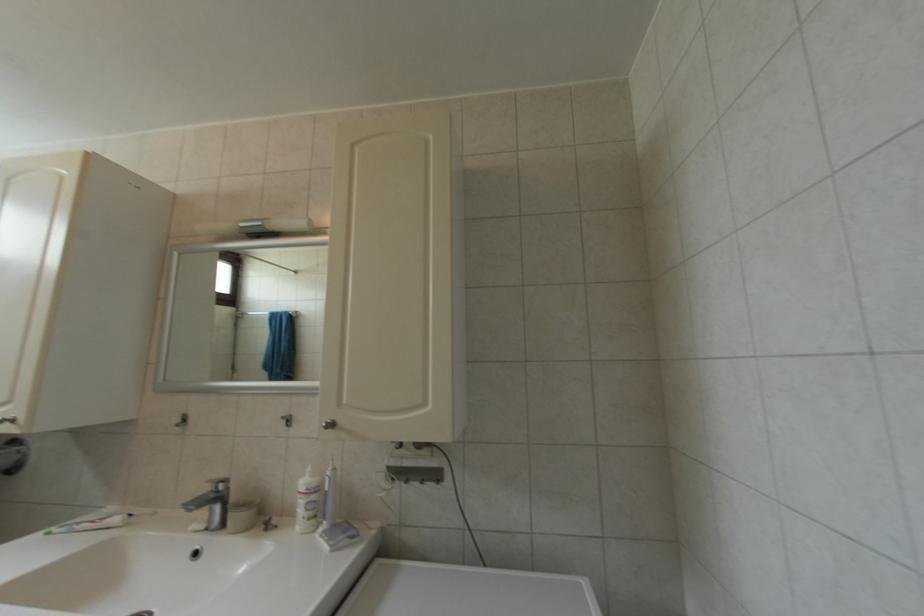
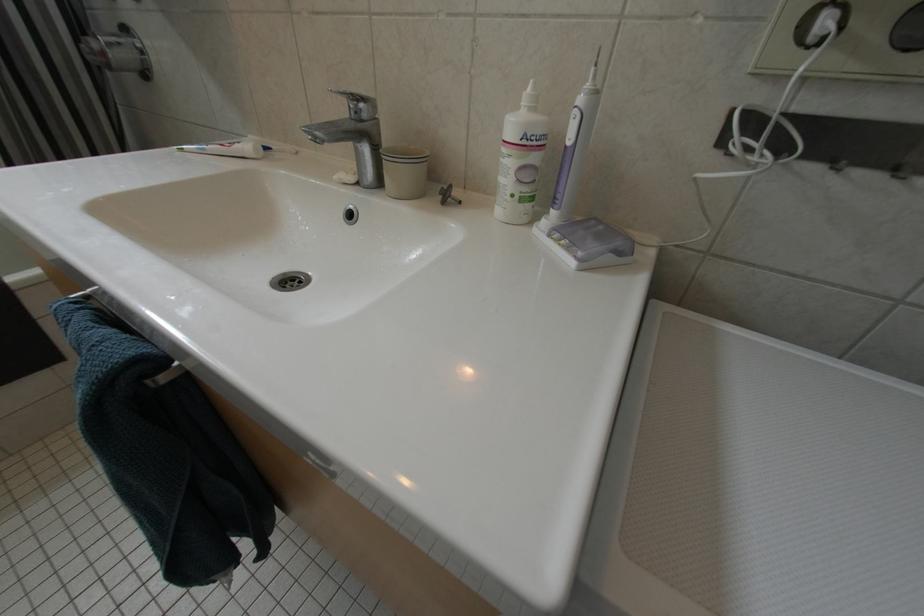
The images are taken continuously from a first-person perspective. In which direction is your viewpoint rotating?

The camera's rotation is toward left-down.